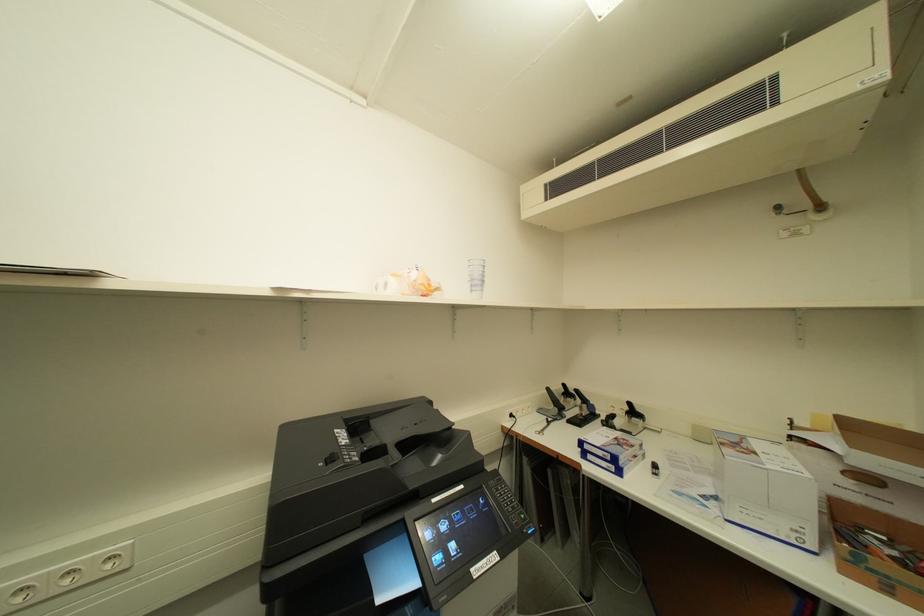
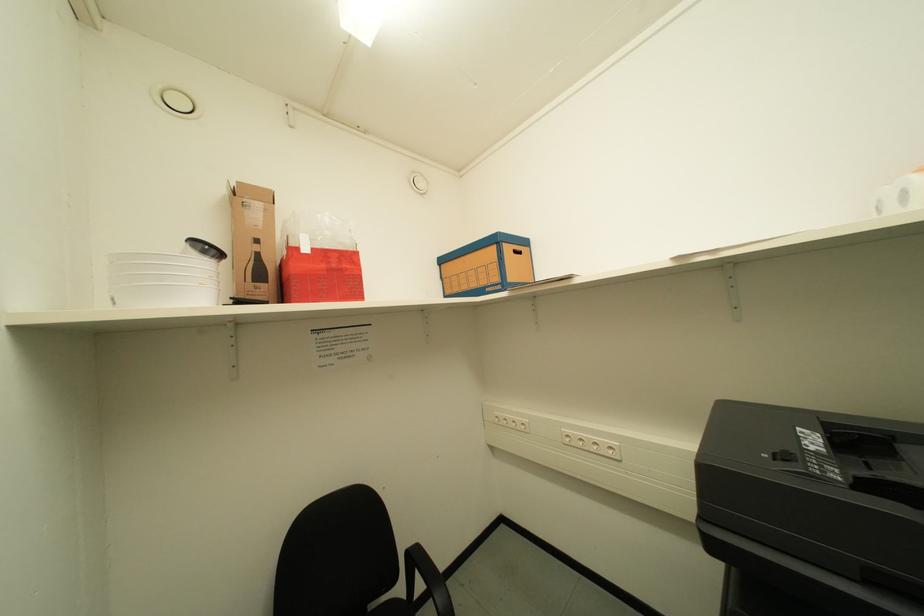
Question: Based on the continuous images, in which direction is the camera rotating? Reply with the corresponding letter.

Choices:
 (A) Left
 (B) Right
 (C) Up
 (D) Down

Answer: (A)